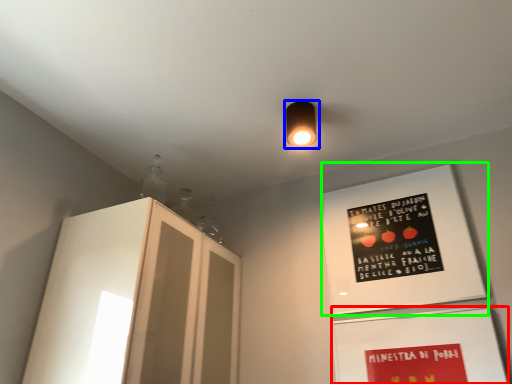
Question: Which is farther away from bulletin board (highlighted by a red box)? lamp (highlighted by a blue box) or bulletin board (highlighted by a green box)?

Choices:
 (A) lamp
 (B) bulletin board

Answer: (A)